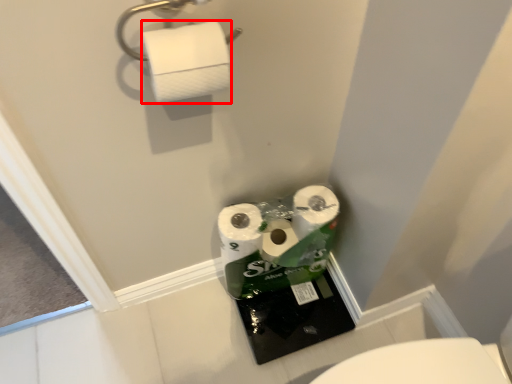
Question: From the image's perspective, where is toilet paper (annotated by the red box) located relative to towel bar?

Choices:
 (A) above
 (B) below

Answer: (B)